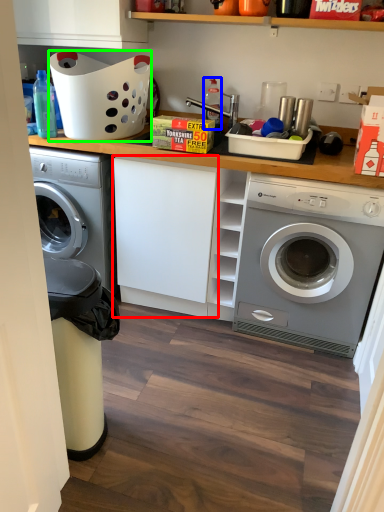
Question: Considering the real-world distances, which object is closest to cabinetry (highlighted by a red box)? bottle (highlighted by a blue box) or basket (highlighted by a green box).

Choices:
 (A) bottle
 (B) basket

Answer: (B)